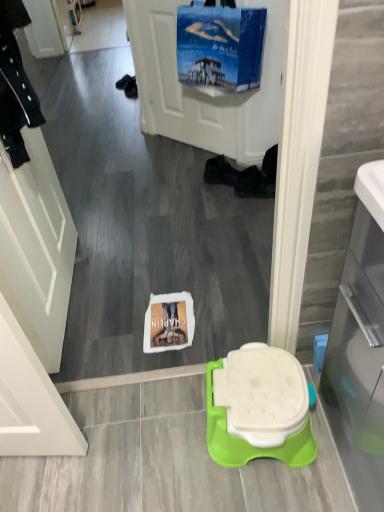
Question: From the image's perspective, does white matte screen door at left, which appears as the 2th screen door when viewed from the right, appear lower than black fabric shoe at center, the first footwear viewed from the left?

Choices:
 (A) no
 (B) yes

Answer: (B)

Question: Does white matte screen door at left, which appears as the 2th screen door when viewed from the right, turn towards black fabric shoe at center, the first footwear viewed from the left?

Choices:
 (A) yes
 (B) no

Answer: (A)

Question: Is the depth of white matte screen door at left, arranged as the first screen door when viewed from the front, greater than that of black fabric shoe at center, which is the second footwear from right to left?

Choices:
 (A) no
 (B) yes

Answer: (A)

Question: Can you confirm if white matte screen door at left, the 2th screen door when ordered from back to front, is taller than black fabric shoe at center, the first footwear viewed from the left?

Choices:
 (A) yes
 (B) no

Answer: (A)

Question: Does white matte screen door at left, which appears as the 2th screen door when viewed from the right, have a lesser width compared to black fabric shoe at center, the first footwear viewed from the left?

Choices:
 (A) no
 (B) yes

Answer: (B)

Question: Considering the relative sizes of white matte screen door at left, which appears as the 2th screen door when viewed from the right, and black fabric shoe at center, the first footwear viewed from the left, in the image provided, is white matte screen door at left, which appears as the 2th screen door when viewed from the right, smaller than black fabric shoe at center, the first footwear viewed from the left,?

Choices:
 (A) no
 (B) yes

Answer: (A)

Question: Is transparent glass door at right positioned in front of blue fabric screen door at upper center, arranged as the first screen door when viewed from the back?

Choices:
 (A) no
 (B) yes

Answer: (B)

Question: Is transparent glass door at right next to blue fabric screen door at upper center, the first screen door when ordered from right to left, and touching it?

Choices:
 (A) no
 (B) yes

Answer: (A)

Question: Can you confirm if transparent glass door at right is wider than blue fabric screen door at upper center, which is the second screen door in front-to-back order?

Choices:
 (A) no
 (B) yes

Answer: (B)

Question: Would you say transparent glass door at right is a long distance from blue fabric screen door at upper center, which is the second screen door in front-to-back order?

Choices:
 (A) yes
 (B) no

Answer: (A)

Question: Does transparent glass door at right have a greater height compared to blue fabric screen door at upper center, the first screen door from the top?

Choices:
 (A) yes
 (B) no

Answer: (B)

Question: Does transparent glass door at right lie behind blue fabric screen door at upper center, arranged as the first screen door when viewed from the back?

Choices:
 (A) no
 (B) yes

Answer: (A)

Question: Is black fabric shoe at center, acting as the first footwear starting from the right, at the left side of white plastic toilet at center?

Choices:
 (A) no
 (B) yes

Answer: (A)